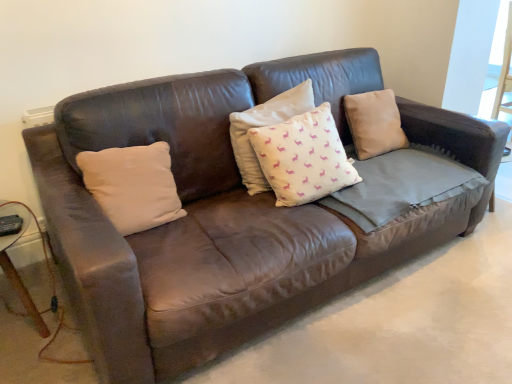
Question: Does white matte pillow at center, acting as the first pillow starting from the left, lie in front of white cotton cushion at center, acting as the 2th pillow starting from the right?

Choices:
 (A) no
 (B) yes

Answer: (B)

Question: Does white matte pillow at center, the 3th pillow in the right-to-left sequence, turn towards white cotton cushion at center, which is the 2th pillow from left to right?

Choices:
 (A) yes
 (B) no

Answer: (B)

Question: From a real-world perspective, is white matte pillow at center, the 3th pillow in the right-to-left sequence, positioned under white cotton cushion at center, which is the 2th pillow from left to right, based on gravity?

Choices:
 (A) no
 (B) yes

Answer: (B)

Question: From a real-world perspective, is white matte pillow at center, acting as the first pillow starting from the left, on white cotton cushion at center, which is the 2th pillow from left to right?

Choices:
 (A) yes
 (B) no

Answer: (B)

Question: From the image's perspective, is white matte pillow at center, the 3th pillow in the right-to-left sequence, on white cotton cushion at center, which is the 2th pillow from left to right?

Choices:
 (A) no
 (B) yes

Answer: (A)

Question: Considering their positions, is white cotton cushion at center, acting as the 2th pillow starting from the right, located in front of or behind white matte pillow at center, the 3th pillow in the right-to-left sequence?

Choices:
 (A) front
 (B) behind

Answer: (B)

Question: From a real-world perspective, is white cotton cushion at center, acting as the 2th pillow starting from the right, above or below white matte pillow at center, the 3th pillow in the right-to-left sequence?

Choices:
 (A) above
 (B) below

Answer: (A)

Question: Considering the positions of white cotton cushion at center, which is the 2th pillow from left to right, and white matte pillow at center, the 3th pillow in the right-to-left sequence, in the image, is white cotton cushion at center, which is the 2th pillow from left to right, bigger or smaller than white matte pillow at center, the 3th pillow in the right-to-left sequence,?

Choices:
 (A) small
 (B) big

Answer: (B)

Question: Is point (347, 183) closer or farther from the camera than point (134, 190)?

Choices:
 (A) closer
 (B) farther

Answer: (B)

Question: From their relative heights in the image, would you say brown leather pillow at upper right, which is the third pillow from left to right, is taller or shorter than white matte pillow at center, acting as the first pillow starting from the left?

Choices:
 (A) short
 (B) tall

Answer: (B)

Question: Is brown leather pillow at upper right, arranged as the 1th pillow when viewed from the right, in front of or behind white matte pillow at center, acting as the first pillow starting from the left, in the image?

Choices:
 (A) front
 (B) behind

Answer: (B)

Question: Is brown leather pillow at upper right, arranged as the 1th pillow when viewed from the right, bigger or smaller than white matte pillow at center, acting as the first pillow starting from the left?

Choices:
 (A) big
 (B) small

Answer: (A)

Question: Would you say brown leather pillow at upper right, arranged as the 1th pillow when viewed from the right, is to the left or to the right of white matte pillow at center, the 3th pillow in the right-to-left sequence, in the picture?

Choices:
 (A) left
 (B) right

Answer: (B)

Question: Considering the positions of white matte pillow at center, the 3th pillow in the right-to-left sequence, and white cotton cushion at center, acting as the 2th pillow starting from the right, in the image, is white matte pillow at center, the 3th pillow in the right-to-left sequence, taller or shorter than white cotton cushion at center, acting as the 2th pillow starting from the right,?

Choices:
 (A) short
 (B) tall

Answer: (A)

Question: Based on their positions, is white matte pillow at center, acting as the first pillow starting from the left, located to the left or right of white cotton cushion at center, which is the 2th pillow from left to right?

Choices:
 (A) right
 (B) left

Answer: (B)